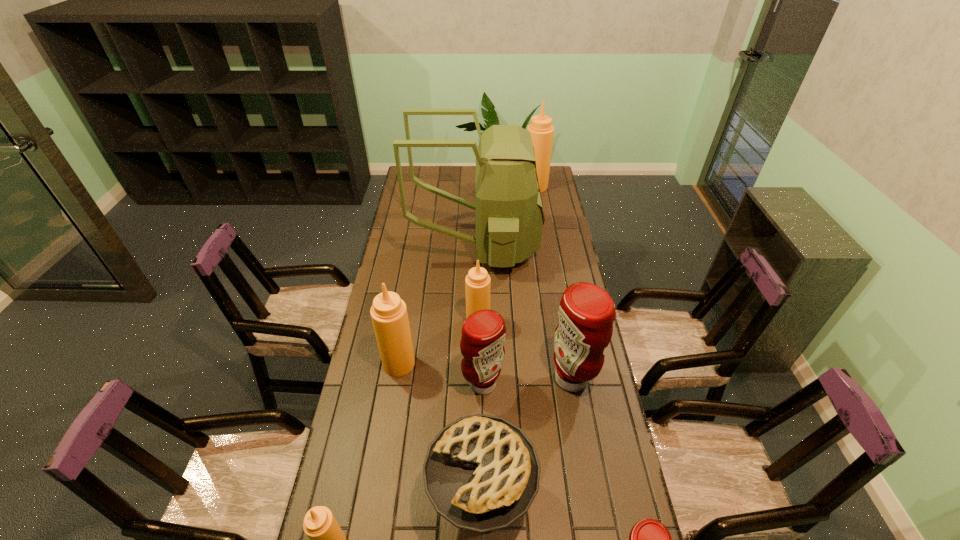
Find the location of a particular element. The image size is (960, 540). object that is at the far right corner is located at coordinates (542, 131).

The image size is (960, 540). Find the location of `vacant space at the left edge of the desktop`. vacant space at the left edge of the desktop is located at coordinates (391, 453).

Find the location of `vacant space at the right edge of the desktop`. vacant space at the right edge of the desktop is located at coordinates (542, 235).

Image resolution: width=960 pixels, height=540 pixels. I want to click on vacant area at the far left corner, so [420, 175].

The width and height of the screenshot is (960, 540). What are the coordinates of `free point between the green backpack and the third farthest tan condiment` in the screenshot? It's located at (438, 305).

Point out which object is positioned as the sixth nearest to the farthest tan condiment. Please provide its 2D coordinates. Your answer should be formatted as a tuple, i.e. [(x, y)], where the tuple contains the x and y coordinates of a point satisfying the conditions above.

[(481, 473)]

Locate an element on the screen. The width and height of the screenshot is (960, 540). the closest object relative to the third farthest object is located at coordinates (483, 333).

Identify the location of the seventh closest condiment relative to the second farthest object. The image size is (960, 540). (649, 539).

Select which condiment is the third closest to the second smallest tan condiment. Please provide its 2D coordinates. Your answer should be formatted as a tuple, i.e. [(x, y)], where the tuple contains the x and y coordinates of a point satisfying the conditions above.

[(586, 312)]

Find the location of a particular element. The image size is (960, 540). the second closest tan condiment relative to the leftmost object is located at coordinates (477, 283).